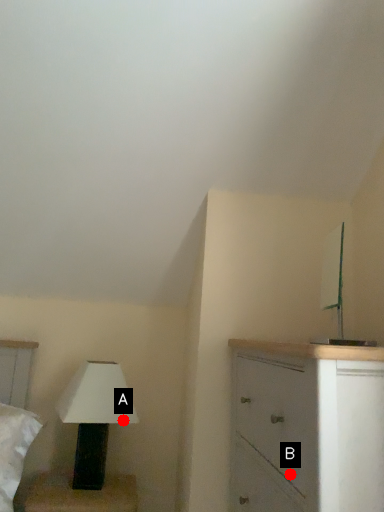
Question: Two points are circled on the image, labeled by A and B beside each circle. Which point appears closest to the camera in this image?

Choices:
 (A) A is closer
 (B) B is closer

Answer: (B)